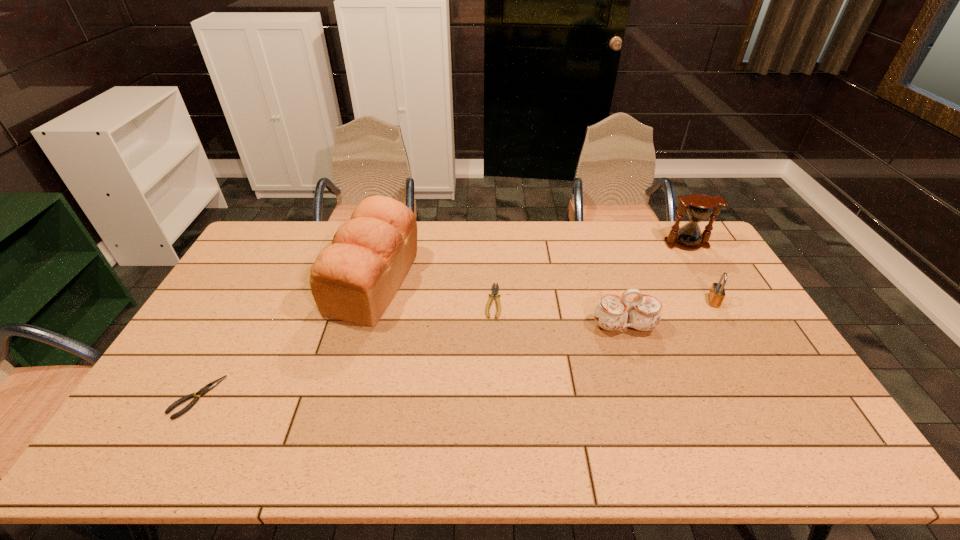
At what (x,y) coordinates should I click in order to perform the action: click on padlock that is at the right edge. Please return your answer as a coordinate pair (x, y). Looking at the image, I should click on (716, 294).

Find the location of a particular element. The image size is (960, 540). object positioned at the far right corner is located at coordinates (699, 207).

Where is `vacant space at the far edge of the desktop`? The width and height of the screenshot is (960, 540). vacant space at the far edge of the desktop is located at coordinates (582, 227).

I want to click on free space at the near edge, so click(395, 445).

What are the coordinates of `free space at the left edge of the desktop` in the screenshot? It's located at (238, 288).

Where is `blank area at the right edge`? The image size is (960, 540). blank area at the right edge is located at coordinates (719, 281).

Find the location of a particular element. Image resolution: width=960 pixels, height=540 pixels. free point at the far left corner is located at coordinates (258, 238).

Where is `free space at the near left corner`? The height and width of the screenshot is (540, 960). free space at the near left corner is located at coordinates (190, 444).

Locate an element on the screen. This screenshot has height=540, width=960. free space at the near right corner of the desktop is located at coordinates (792, 434).

You are a GUI agent. You are given a task and a screenshot of the screen. Output one action in this format:
    pyautogui.click(x=<x>, y=<y>)
    Task: Click on the vacant space that's between the tallest object and the farther pliers
    This screenshot has width=960, height=540.
    Given the screenshot: What is the action you would take?
    pyautogui.click(x=434, y=292)